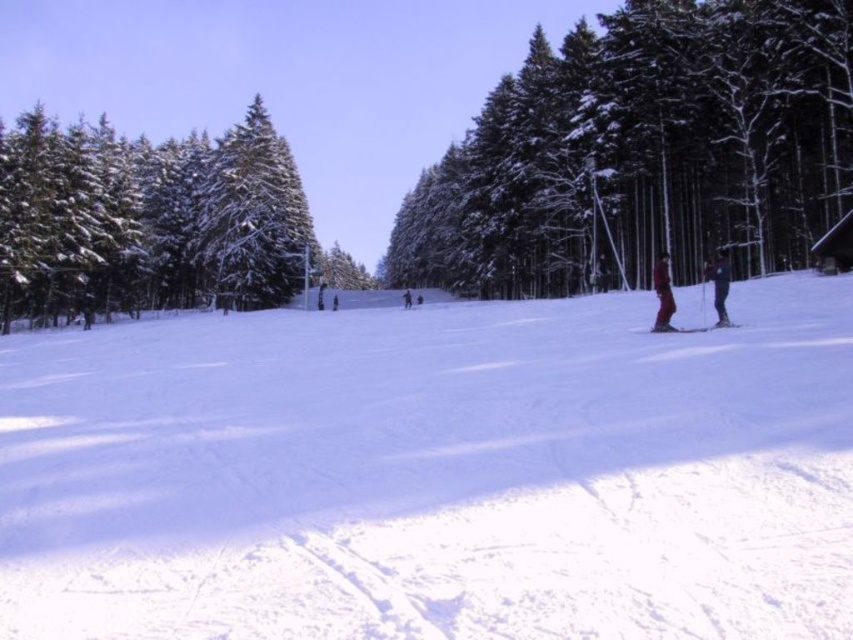
Is point (630, 193) closer to viewer compared to point (635, 330)?

No, (630, 193) is behind (635, 330).

Can you confirm if snow-covered evergreen trees at center is bigger than matte red ski at right?

Yes, snow-covered evergreen trees at center is bigger than matte red ski at right.

Is point (798, 109) in front of point (688, 328)?

No, it is behind (688, 328).

Identify the location of snow-covered evergreen trees at center. (643, 150).

Between white powdery snow at center and red fabric skier at right, which one appears on the right side from the viewer's perspective?

Positioned to the right is red fabric skier at right.

Does white powdery snow at center appear under red fabric skier at right?

Yes.

Is point (496, 477) positioned behind point (663, 268)?

No, it is not.

I want to click on white powdery snow at center, so click(x=434, y=474).

Is point (718, 276) positioned in front of point (664, 326)?

That is False.

Is dark blue ski pants at right wider than matte red ski at right?

Indeed, dark blue ski pants at right has a greater width compared to matte red ski at right.

Which is behind, point (718, 323) or point (643, 330)?

The point (643, 330) is behind.

This screenshot has height=640, width=853. Identify the location of dark blue ski pants at right. (718, 282).